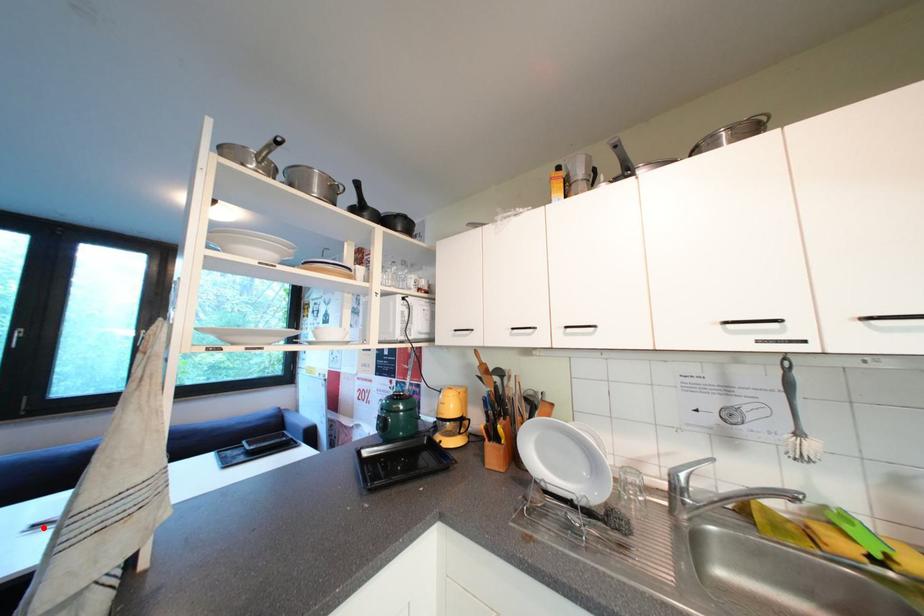
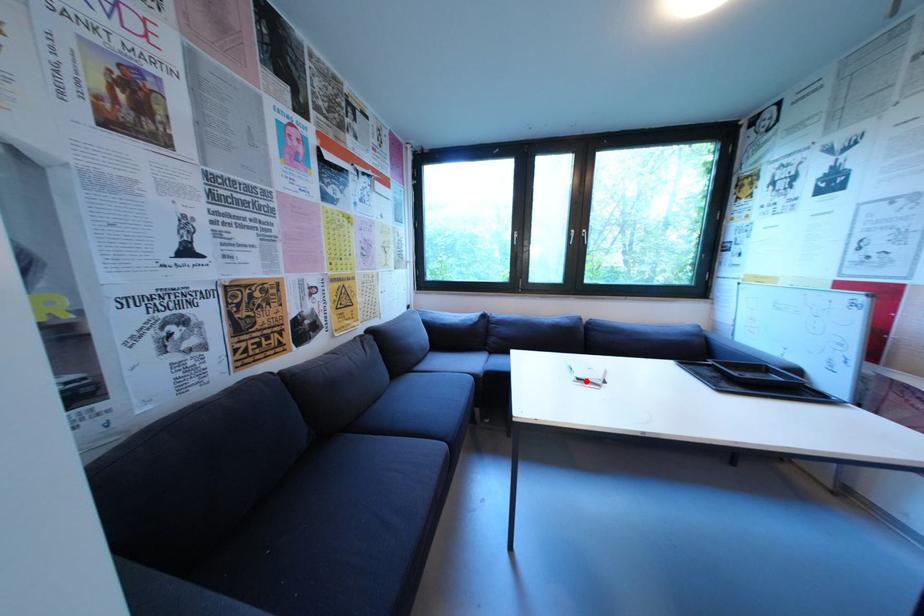
I am providing you with two images of the same scene from different viewpoints. A red point is marked on the first image and another point is marked on the second image. Is the marked point in image1 the same physical position as the marked point in image2?

Yes